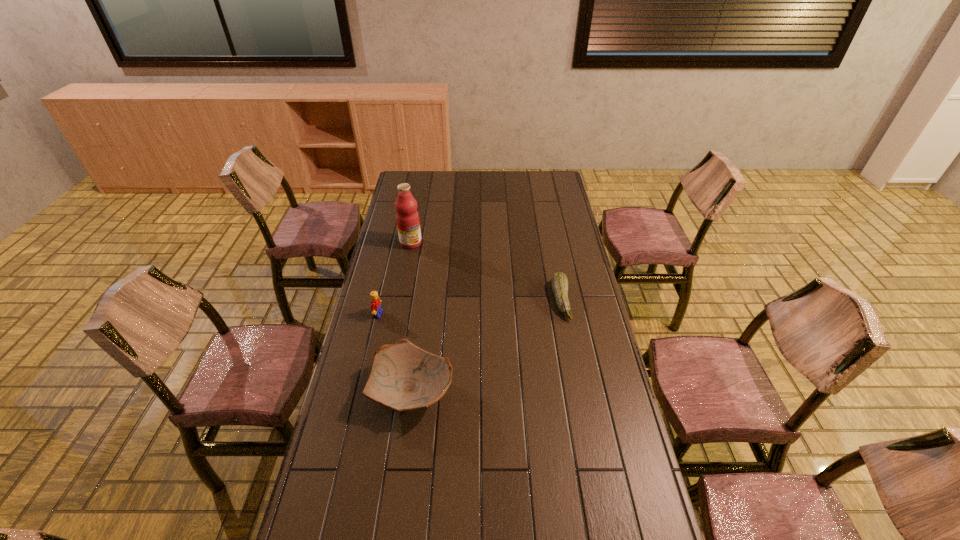
Locate an element on the screen. free space between the pottery and the fruit juice is located at coordinates (412, 317).

Find the location of a particular element. This screenshot has height=540, width=960. free spot between the pottery and the zucchini is located at coordinates (487, 346).

Locate an element on the screen. The image size is (960, 540). unoccupied position between the fruit juice and the Lego is located at coordinates (395, 279).

You are a GUI agent. You are given a task and a screenshot of the screen. Output one action in this format:
    pyautogui.click(x=<x>, y=<y>)
    Task: Click on the closest object to the zucchini
    The image size is (960, 540).
    Given the screenshot: What is the action you would take?
    pyautogui.click(x=404, y=377)

Locate an element on the screen. This screenshot has height=540, width=960. the second closest object to the leftmost object is located at coordinates (407, 217).

Find the location of a particular element. This screenshot has width=960, height=540. free location that satisfies the following two spatial constraints: 1. on the back side of the leftmost object; 2. at the stem end of the shortest object is located at coordinates (381, 300).

Where is `vacant position in the image that satisfies the following two spatial constraints: 1. on the back side of the zucchini; 2. at the stem end of the pottery`? Image resolution: width=960 pixels, height=540 pixels. vacant position in the image that satisfies the following two spatial constraints: 1. on the back side of the zucchini; 2. at the stem end of the pottery is located at coordinates (424, 300).

At what (x,y) coordinates should I click in order to perform the action: click on free spot that satisfies the following two spatial constraints: 1. on the back side of the zucchini; 2. at the stem end of the pottery. Please return your answer as a coordinate pair (x, y). Image resolution: width=960 pixels, height=540 pixels. Looking at the image, I should click on (424, 300).